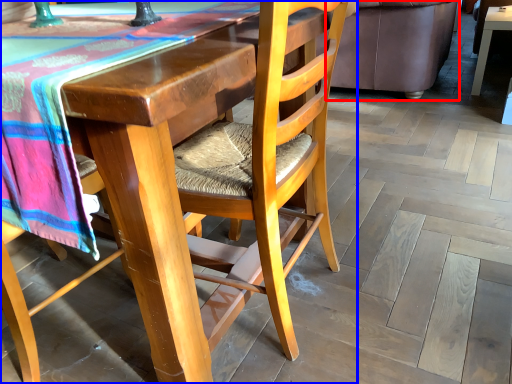
Question: Among these objects, which one is farthest to the camera, couch (highlighted by a red box) or chair (highlighted by a blue box)?

Choices:
 (A) couch
 (B) chair

Answer: (A)